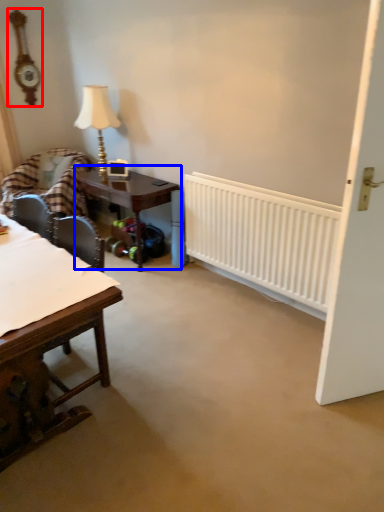
Question: Among these objects, which one is farthest to the camera, clock (highlighted by a red box) or table (highlighted by a blue box)?

Choices:
 (A) clock
 (B) table

Answer: (A)